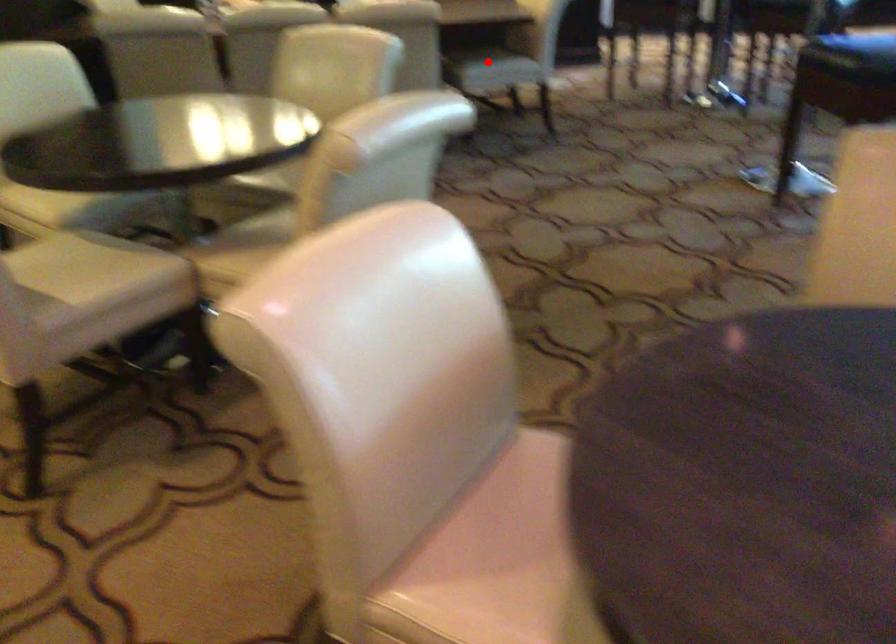
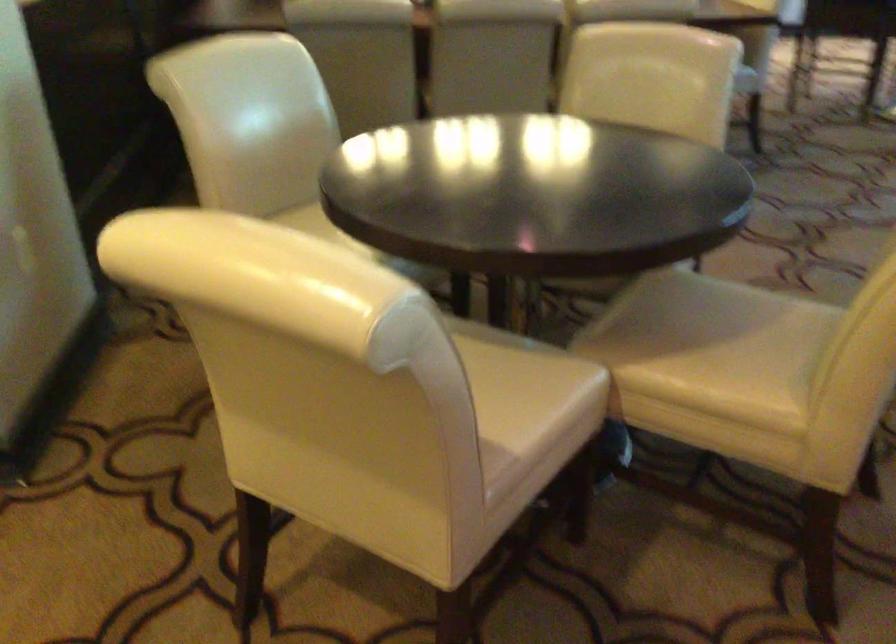
Question: I am providing you with two images of the same scene from different viewpoints. A red point is marked on the first image. Can you still see the location of the red point in image 2?

Choices:
 (A) Yes
 (B) No

Answer: (B)